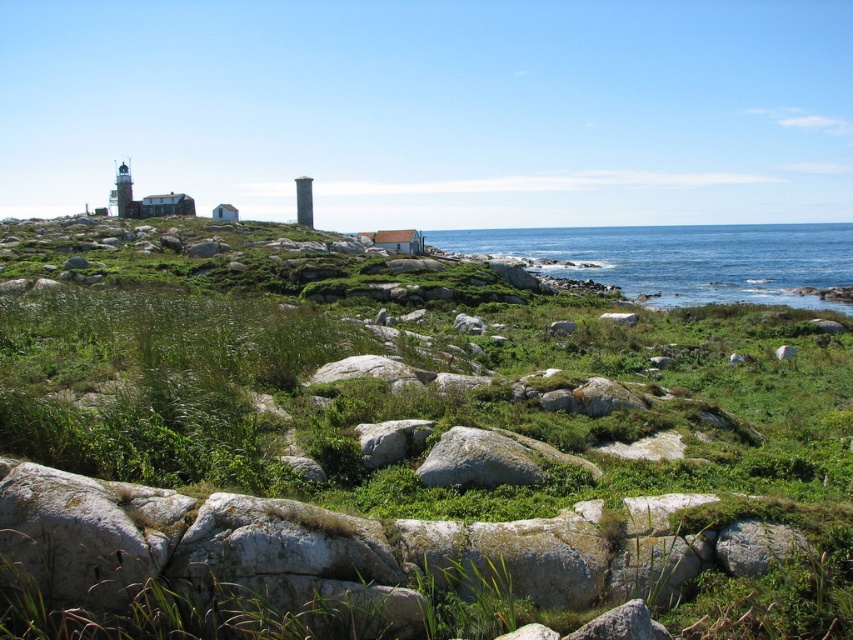
Can you confirm if blue water at lower center is smaller than green mossy rock at center-right?

No, blue water at lower center is not smaller than green mossy rock at center-right.

Who is taller, blue water at lower center or green mossy rock at center-right?

blue water at lower center

Between point (426, 237) and point (778, 349), which one is positioned behind?

The point (426, 237) is more distant.

Where is `blue water at lower center`? blue water at lower center is located at coordinates (x=680, y=259).

Does white painted metal lighthouse at left lie behind green mossy rock at center-right?

That is True.

Which is in front, point (120, 208) or point (779, 349)?

Point (779, 349) is in front.

Is point (119, 216) positioned behind point (780, 355)?

Yes, it is behind point (780, 355).

The width and height of the screenshot is (853, 640). Find the location of `white painted metal lighthouse at left`. white painted metal lighthouse at left is located at coordinates (122, 189).

Who is shorter, gray stone tower at center or white painted metal lighthouse at left?

gray stone tower at center

Between gray stone tower at center and white painted metal lighthouse at left, which one has more height?

white painted metal lighthouse at left

Find the location of a particular element. The height and width of the screenshot is (640, 853). gray stone tower at center is located at coordinates (305, 200).

Where is `gray stone tower at center`? gray stone tower at center is located at coordinates (305, 200).